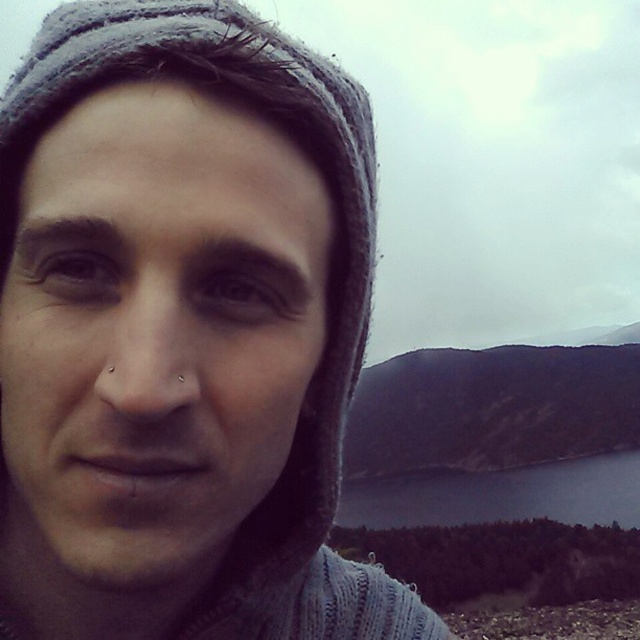
Is matte gray knit cap at upper left below dark blue water at lower center?

No, matte gray knit cap at upper left is not below dark blue water at lower center.

The height and width of the screenshot is (640, 640). Describe the element at coordinates (154, 333) in the screenshot. I see `matte gray knit cap at upper left` at that location.

The image size is (640, 640). I want to click on matte gray knit cap at upper left, so click(154, 333).